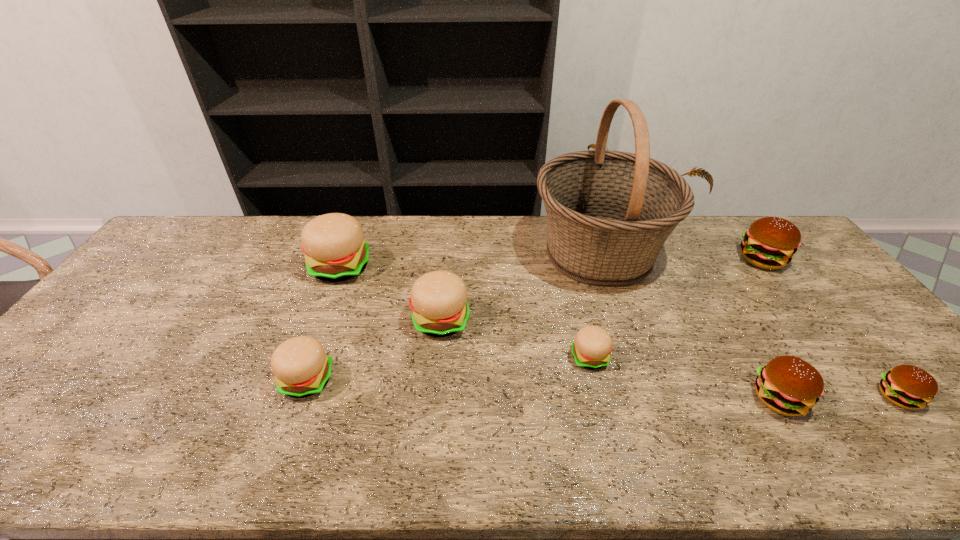
Identify the location of brown hamburger that stands as the closest to the second smallest brown hamburger. This screenshot has height=540, width=960. (906, 386).

Find the location of `vacant space that satisfies the following two spatial constraints: 1. on the front side of the smallest beige hamburger; 2. on the left side of the second beige hamburger from right to left`. vacant space that satisfies the following two spatial constraints: 1. on the front side of the smallest beige hamburger; 2. on the left side of the second beige hamburger from right to left is located at coordinates (438, 357).

Find the location of a particular element. The width and height of the screenshot is (960, 540). free location that satisfies the following two spatial constraints: 1. on the back side of the biggest brown hamburger; 2. on the left side of the biggest beige hamburger is located at coordinates (344, 259).